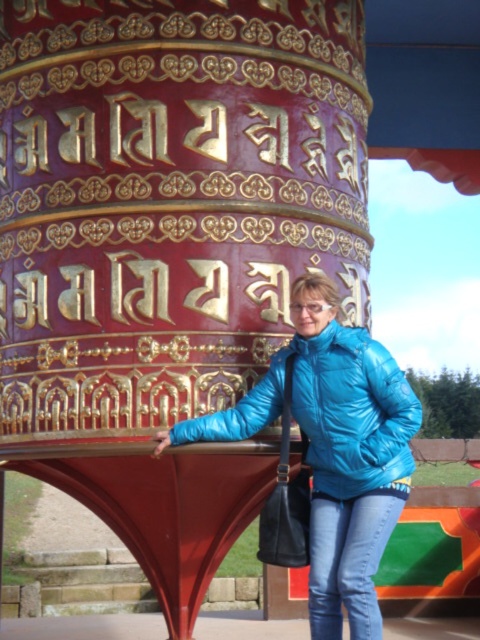
Does blue glossy jacket at center have a lesser width compared to blue shiny jacket at center?

No, blue glossy jacket at center is not thinner than blue shiny jacket at center.

Can you confirm if blue glossy jacket at center is positioned below blue shiny jacket at center?

Yes.

Who is more forward, (380, 410) or (387, 445)?

Positioned in front is point (387, 445).

In order to click on blue glossy jacket at center in this screenshot , I will do `click(334, 449)`.